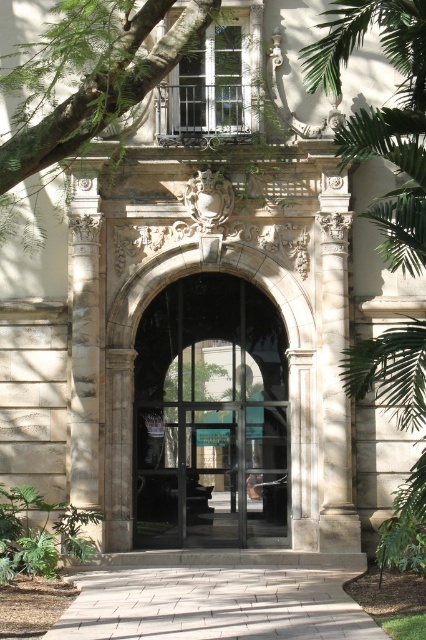
You are a delivery person trying to bring a large package through the entrance. The clear glass door at center and the green leafy tree at right are in your path. Based on their sizes, which one do you need to avoid hitting with your package?

The clear glass door at center has a lesser width compared to green leafy tree at right, so you should avoid hitting the clear glass door at center as it is narrower and more likely to be obstructed by the package.

You are standing in front of the grand entrance and want to enter through the clear glass door at center. Which direction should you move relative to the green leafy tree at upper left to reach it?

You should move to the right of the green leafy tree at upper left to reach the clear glass door at center since the clear glass door at center is located to the right of the green leafy tree at upper left.